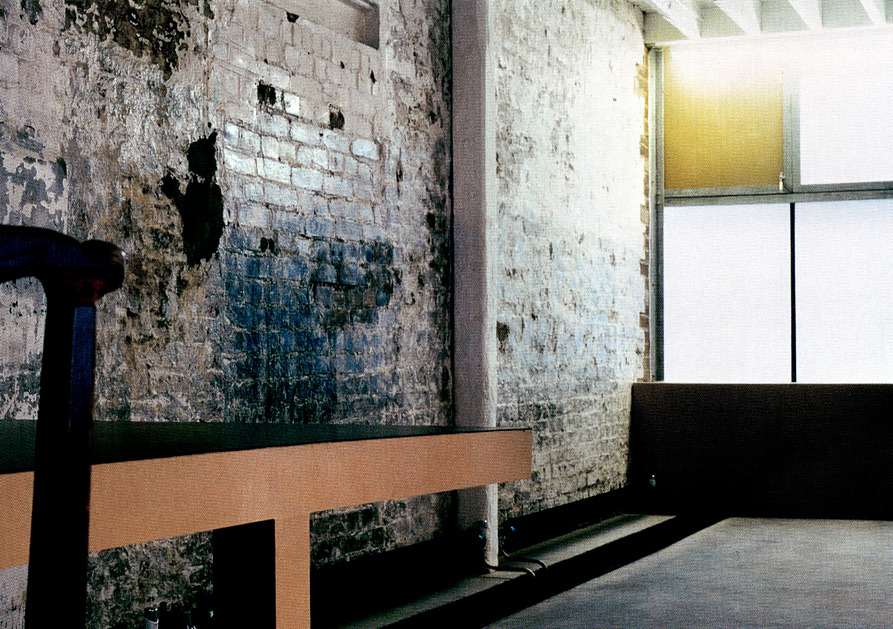
Locate an element on the screen. This screenshot has width=893, height=629. edge of table is located at coordinates (288, 480).